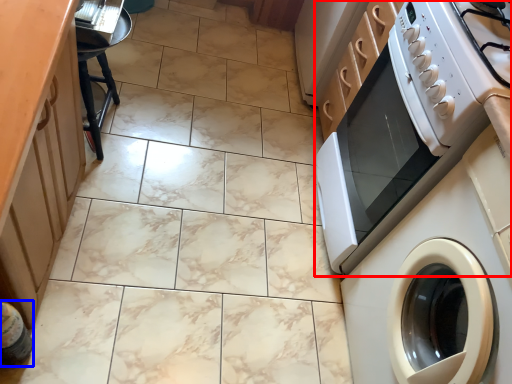
Question: Which object appears farthest to the camera in this image, home appliance (highlighted by a red box) or bottle (highlighted by a blue box)?

Choices:
 (A) home appliance
 (B) bottle

Answer: (A)